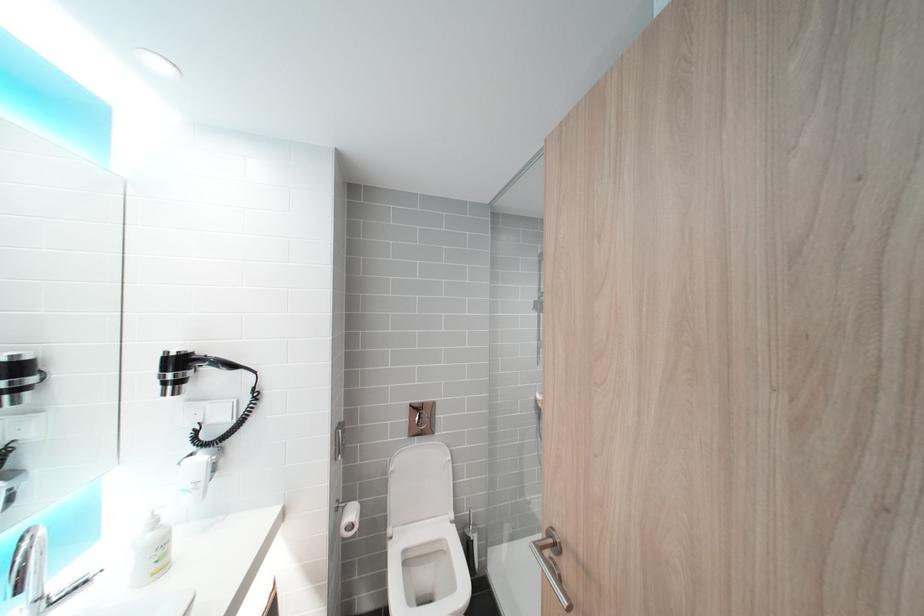
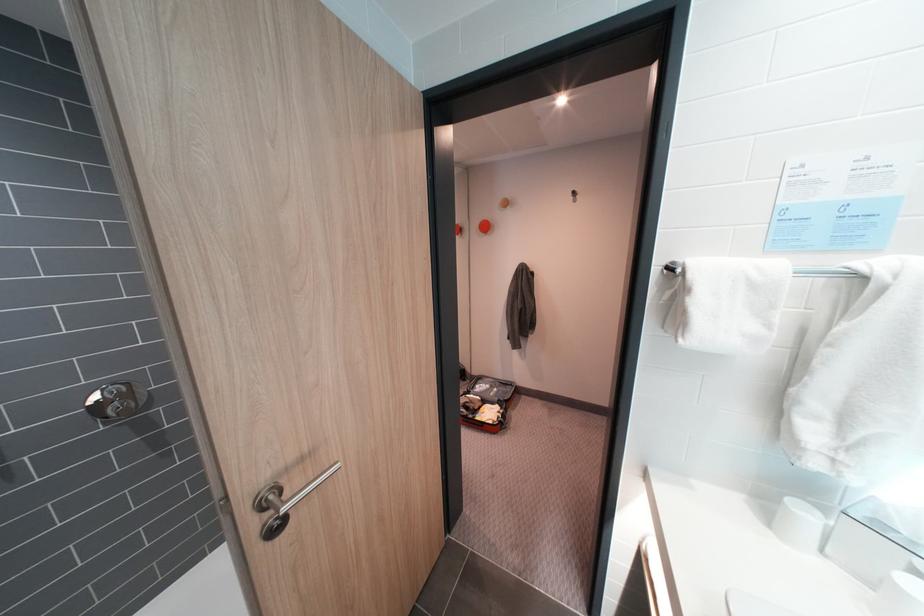
Where in the second image is the point corresponding to the point at 565,527 from the first image?

(274, 488)